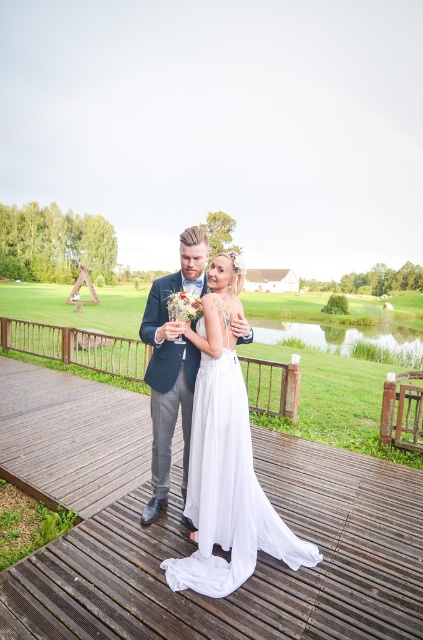
Question: Considering the real-world distances, which object is closest to the wooden deck at center?

Choices:
 (A) matte blue suit at center
 (B) white satin dress at center

Answer: (B)

Question: Which object appears farthest from the camera in this image?

Choices:
 (A) matte blue suit at center
 (B) white satin dress at center
 (C) wooden deck at center

Answer: (C)

Question: Is white satin dress at center positioned before matte blue suit at center?

Choices:
 (A) yes
 (B) no

Answer: (A)

Question: Is wooden deck at center to the left of matte blue suit at center from the viewer's perspective?

Choices:
 (A) yes
 (B) no

Answer: (B)

Question: Is wooden deck at center further to camera compared to matte blue suit at center?

Choices:
 (A) no
 (B) yes

Answer: (B)

Question: Which is nearer to the wooden deck at center?

Choices:
 (A) white satin dress at center
 (B) matte blue suit at center

Answer: (A)